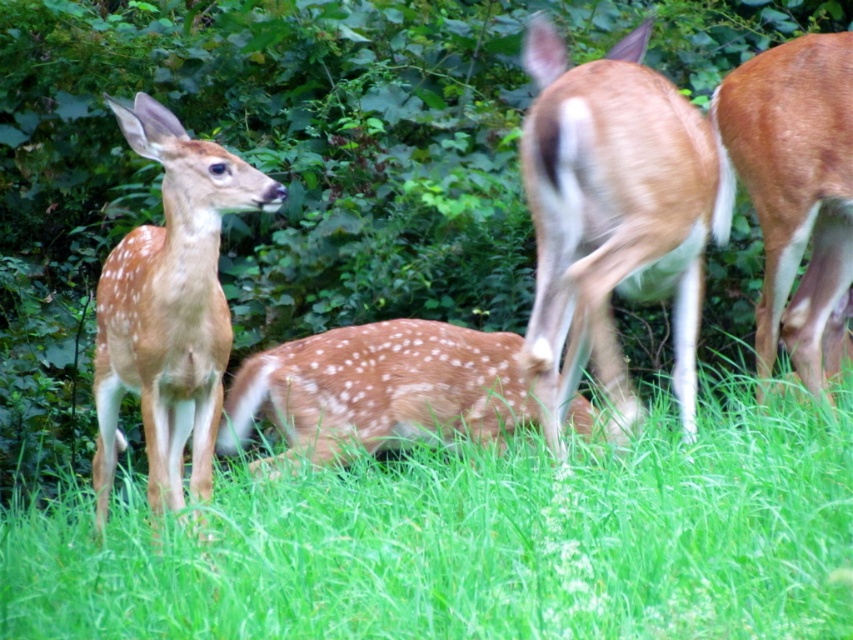
You are standing at the point labeled as point (x=476, y=540) in the forest scene. What is the immediate terrain you are standing on?

The point (x=476, y=540) is on the green grassy area at lower center.